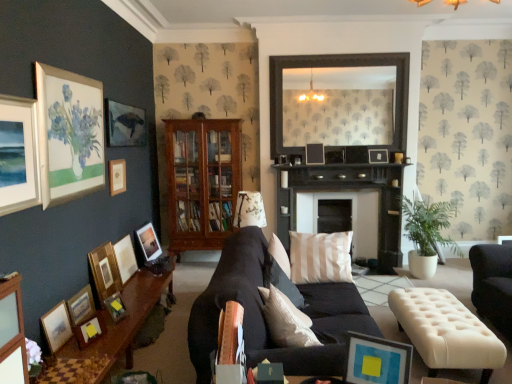
Question: Should I look upward or downward to see matte black picture frame at upper center, the 10th picture frame positioned from the left?

Choices:
 (A) up
 (B) down

Answer: (A)

Question: Does matte wooden picture frame at center, which is the seventh picture frame from right to left, appear on the right side of matte yellow picture frame at lower left, the eighth picture frame from the left?

Choices:
 (A) no
 (B) yes

Answer: (A)

Question: From a real-world perspective, is matte wooden picture frame at center, positioned as the seventh picture frame in left-to-right order, below matte yellow picture frame at lower left, which ranks as the sixth picture frame in right-to-left order?

Choices:
 (A) yes
 (B) no

Answer: (B)

Question: Is matte wooden picture frame at center, positioned as the seventh picture frame in left-to-right order, smaller than matte yellow picture frame at lower left, the eighth picture frame from the left?

Choices:
 (A) no
 (B) yes

Answer: (A)

Question: Can you confirm if matte wooden picture frame at center, positioned as the seventh picture frame in left-to-right order, is wider than matte yellow picture frame at lower left, the eighth picture frame from the left?

Choices:
 (A) no
 (B) yes

Answer: (B)

Question: From the image's perspective, would you say matte wooden picture frame at center, which is the seventh picture frame from right to left, is shown under matte yellow picture frame at lower left, which ranks as the sixth picture frame in right-to-left order?

Choices:
 (A) no
 (B) yes

Answer: (A)

Question: Is matte wooden picture frame at center, positioned as the seventh picture frame in left-to-right order, outside of matte yellow picture frame at lower left, the eighth picture frame from the left?

Choices:
 (A) no
 (B) yes

Answer: (B)

Question: From the image's perspective, is matte white picture frame at upper left, which is the 1th picture frame from left to right, over matte yellow picture frame at lower left, the eighth picture frame from the left?

Choices:
 (A) yes
 (B) no

Answer: (A)

Question: Considering the relative sizes of matte white picture frame at upper left, which is the 1th picture frame from left to right, and matte yellow picture frame at lower left, which ranks as the sixth picture frame in right-to-left order, in the image provided, is matte white picture frame at upper left, which is the 1th picture frame from left to right, wider than matte yellow picture frame at lower left, which ranks as the sixth picture frame in right-to-left order,?

Choices:
 (A) no
 (B) yes

Answer: (A)

Question: Is matte white picture frame at upper left, which is the 1th picture frame from left to right, outside matte yellow picture frame at lower left, which ranks as the sixth picture frame in right-to-left order?

Choices:
 (A) no
 (B) yes

Answer: (B)

Question: Is matte white picture frame at upper left, which is the 1th picture frame from left to right, positioned behind matte yellow picture frame at lower left, the eighth picture frame from the left?

Choices:
 (A) no
 (B) yes

Answer: (A)

Question: Does matte white picture frame at upper left, which is counted as the thirteenth picture frame, starting from the right, have a lesser height compared to matte yellow picture frame at lower left, which ranks as the sixth picture frame in right-to-left order?

Choices:
 (A) yes
 (B) no

Answer: (B)

Question: Is matte white picture frame at upper left, which is the 1th picture frame from left to right, to the left of matte yellow picture frame at lower left, which ranks as the sixth picture frame in right-to-left order, from the viewer's perspective?

Choices:
 (A) no
 (B) yes

Answer: (B)

Question: Does matte black picture frame at upper center, which ranks as the fourth picture frame in right-to-left order, come behind green leafy plant at right?

Choices:
 (A) yes
 (B) no

Answer: (A)